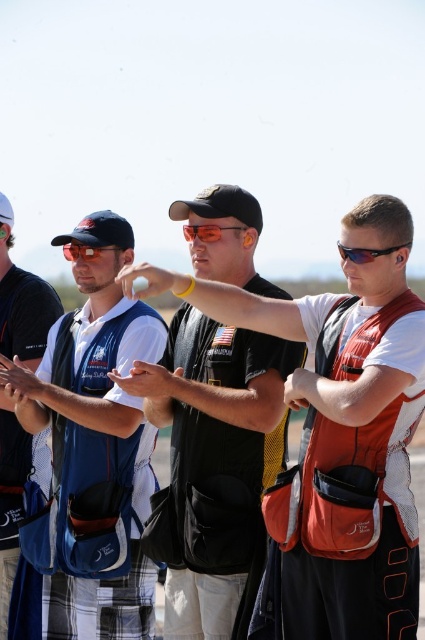
Question: Which object is the closest to the shiny black sunglasses at center?

Choices:
 (A) black matte vest at center
 (B) black fabric baseball cap at center

Answer: (B)

Question: Is blue mesh vest at center further to camera compared to blue fabric vest at left?

Choices:
 (A) yes
 (B) no

Answer: (B)

Question: Does shiny black sunglasses at center appear under matte black goggles at center?

Choices:
 (A) no
 (B) yes

Answer: (B)

Question: Among these points, which one is farthest from the camera?

Choices:
 (A) (0, 212)
 (B) (98, 246)

Answer: (A)

Question: Which of the following is the closest to the observer?

Choices:
 (A) (178, 490)
 (B) (19, 483)
 (C) (112, 572)
 (D) (240, 225)

Answer: (C)

Question: Does black matte vest at center appear on the right side of black fabric baseball cap at upper left?

Choices:
 (A) no
 (B) yes

Answer: (B)